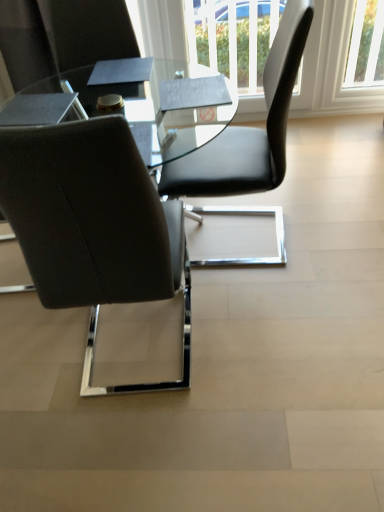
Question: Is white plastic window at upper right wider than black leather chair at upper right, acting as the first chair starting from the right?

Choices:
 (A) no
 (B) yes

Answer: (A)

Question: Is white plastic window at upper right thinner than black leather chair at upper right, acting as the 2th chair starting from the left?

Choices:
 (A) yes
 (B) no

Answer: (A)

Question: Would you say white plastic window at upper right is outside black leather chair at upper right, acting as the first chair starting from the right?

Choices:
 (A) no
 (B) yes

Answer: (B)

Question: Is black leather chair at upper right, acting as the 2th chair starting from the left, at the back of white plastic window at upper right?

Choices:
 (A) yes
 (B) no

Answer: (B)

Question: From the image's perspective, would you say white plastic window at upper right is shown under black leather chair at upper right, acting as the 2th chair starting from the left?

Choices:
 (A) no
 (B) yes

Answer: (A)

Question: Is white plastic window at upper right to the left of black leather chair at upper right, acting as the 2th chair starting from the left, from the viewer's perspective?

Choices:
 (A) yes
 (B) no

Answer: (B)

Question: From a real-world perspective, is matte black chair at left, the 2th chair from the right, positioned over white plastic window at upper right based on gravity?

Choices:
 (A) no
 (B) yes

Answer: (B)

Question: Is matte black chair at left, the 2th chair from the right, facing away from white plastic window at upper right?

Choices:
 (A) yes
 (B) no

Answer: (B)

Question: From the image's perspective, is matte black chair at left, the 1th chair when ordered from left to right, located above white plastic window at upper right?

Choices:
 (A) yes
 (B) no

Answer: (B)

Question: Is matte black chair at left, the 2th chair from the right, to the left of white plastic window at upper right from the viewer's perspective?

Choices:
 (A) yes
 (B) no

Answer: (A)

Question: Does matte black chair at left, the 2th chair from the right, touch white plastic window at upper right?

Choices:
 (A) no
 (B) yes

Answer: (A)

Question: From a real-world perspective, is matte black chair at left, the 1th chair when ordered from left to right, located beneath white plastic window at upper right?

Choices:
 (A) no
 (B) yes

Answer: (A)

Question: Does matte black chair at left, the 2th chair from the right, have a smaller size compared to black leather chair at upper right, acting as the 2th chair starting from the left?

Choices:
 (A) no
 (B) yes

Answer: (B)